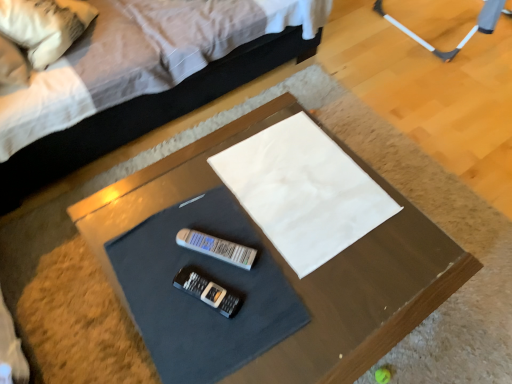
The image size is (512, 384). What are the coordinates of `free space below white fabric at center (from a real-world perspective)` in the screenshot? It's located at (303, 187).